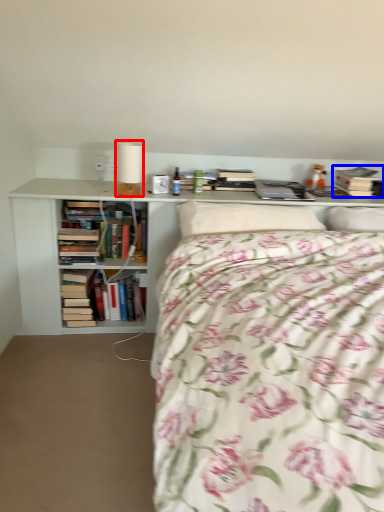
Question: Which of the following is the closest to the observer, table lamp (highlighted by a red box) or book (highlighted by a blue box)?

Choices:
 (A) table lamp
 (B) book

Answer: (A)